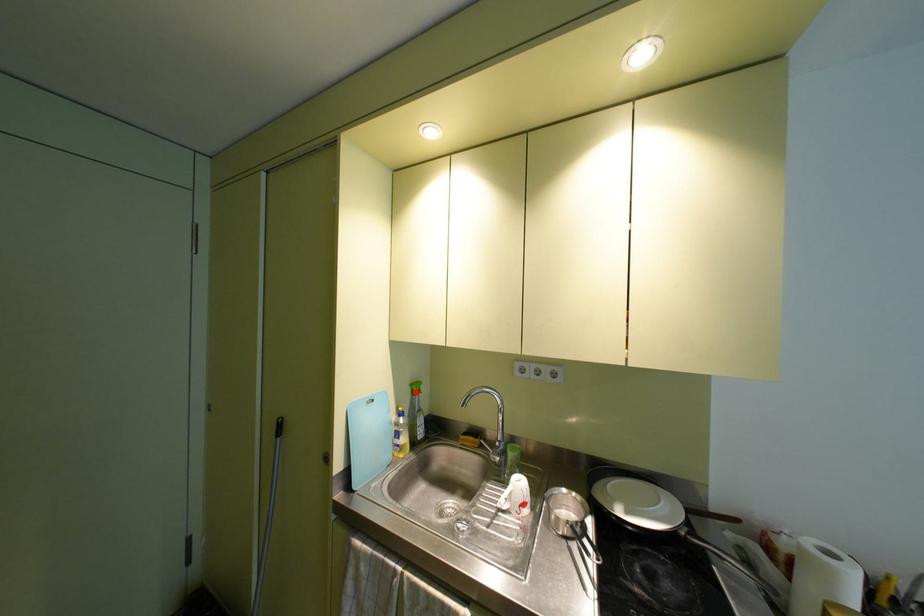
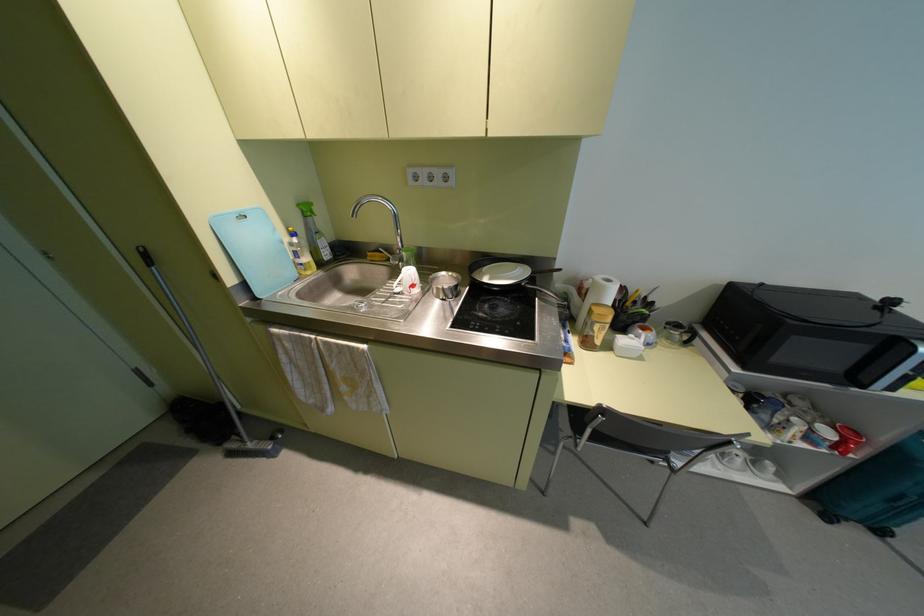
Question: I am providing you with two images of the same scene from different viewpoints. A red point is shown in image1. For the corresponding object point in image2, is it positioned nearer or farther from the camera?

Choices:
 (A) Nearer
 (B) Farther

Answer: (A)